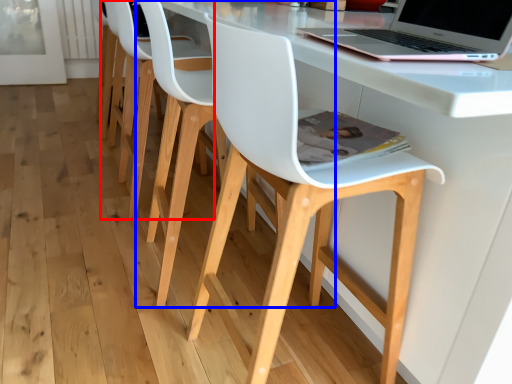
Question: Which of the following is the closest to the observer, chair (highlighted by a red box) or chair (highlighted by a blue box)?

Choices:
 (A) chair
 (B) chair

Answer: (B)